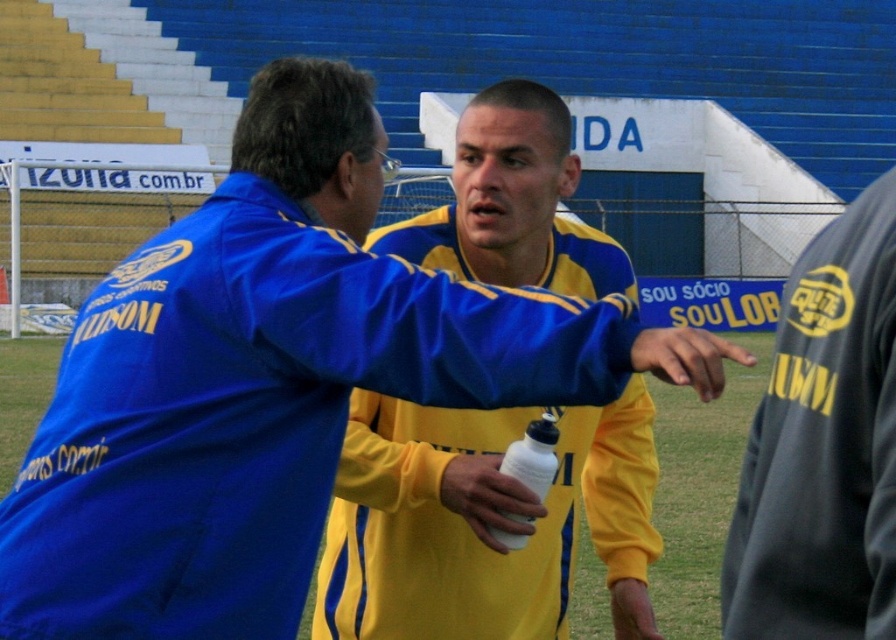
Who is positioned more to the right, dark gray fabric at right or white matte water bottle at center?

Positioned to the right is dark gray fabric at right.

Is dark gray fabric at right bigger than white matte water bottle at center?

Yes, dark gray fabric at right is bigger than white matte water bottle at center.

Who is more distant from viewer, (x=874, y=570) or (x=540, y=509)?

The point (x=540, y=509) is more distant.

I want to click on dark gray fabric at right, so click(823, 445).

Can you confirm if yellow/yellowish fabric shirt at center is positioned to the right of white matte water bottle at center?

Incorrect, yellow/yellowish fabric shirt at center is not on the right side of white matte water bottle at center.

Based on the photo, which of these two, yellow/yellowish fabric shirt at center or white matte water bottle at center, stands taller?

yellow/yellowish fabric shirt at center

Who is more distant from viewer, (385, 529) or (472, 492)?

Positioned behind is point (385, 529).

Image resolution: width=896 pixels, height=640 pixels. Find the location of `yellow/yellowish fabric shirt at center`. yellow/yellowish fabric shirt at center is located at coordinates (481, 522).

Is yellow/yellowish fabric shirt at center positioned in front of yellow/yellowish matte/slightly glossy hand at center?

That is False.

Consider the image. Is yellow/yellowish fabric shirt at center above yellow/yellowish matte/slightly glossy hand at center?

Actually, yellow/yellowish fabric shirt at center is below yellow/yellowish matte/slightly glossy hand at center.

Is point (382, 468) more distant than point (656, 344)?

Yes, it is.

At what (x,y) coordinates should I click in order to perform the action: click on yellow/yellowish fabric shirt at center. Please return your answer as a coordinate pair (x, y). Image resolution: width=896 pixels, height=640 pixels. Looking at the image, I should click on (481, 522).